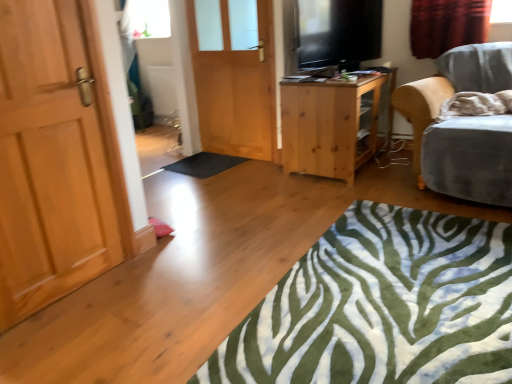
Question: Considering the positions of velvet grey chair at right and light brown wooden door at left, the second door positioned from the back, in the image, is velvet grey chair at right taller or shorter than light brown wooden door at left, the second door positioned from the back,?

Choices:
 (A) short
 (B) tall

Answer: (A)

Question: From a real-world perspective, is velvet grey chair at right above or below light brown wooden door at left, the 1th door from the left?

Choices:
 (A) above
 (B) below

Answer: (B)

Question: Estimate the real-world distances between objects in this image. Which object is closer to the red velvet curtain at upper right?

Choices:
 (A) light brown wooden table at center
 (B) black rubber mat at center
 (C) velvet grey chair at right
 (D) matte wooden door at center, which is the 1th door in back-to-front order
 (E) green zebra-patterned rug at lower center

Answer: (C)

Question: Considering the real-world distances, which object is closest to the light brown wooden door at left, positioned as the 1th door in front-to-back order?

Choices:
 (A) matte wooden door at center, the second door positioned from the front
 (B) black rubber mat at center
 (C) green zebra-patterned rug at lower center
 (D) flat screen tv at upper right
 (E) light brown wooden table at center

Answer: (C)